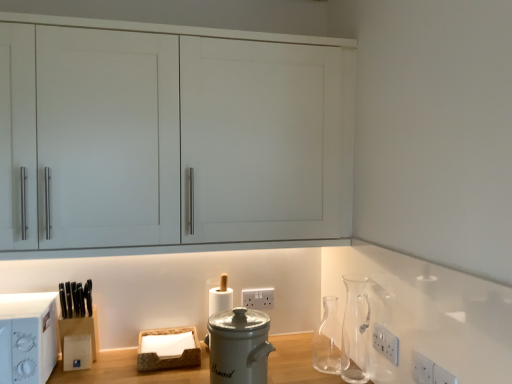
Question: From the image's perspective, is white plastic electric outlet at lower right, the 2th electric outlet from the right, located above or below white plastic electric outlet at lower center, the 1th electric outlet viewed from the left?

Choices:
 (A) above
 (B) below

Answer: (B)

Question: Considering the positions of white plastic electric outlet at lower right, the second electric outlet from the front, and white plastic electric outlet at lower center, acting as the fourth electric outlet starting from the right, in the image, is white plastic electric outlet at lower right, the second electric outlet from the front, bigger or smaller than white plastic electric outlet at lower center, acting as the fourth electric outlet starting from the right,?

Choices:
 (A) small
 (B) big

Answer: (A)

Question: Which is farther from the white plastic microwave at left?

Choices:
 (A) white plastic electric outlet at lower center, acting as the 1th electric outlet starting from the back
 (B) transparent glass carafe at center-right
 (C) transparent glass carafe at right
 (D) brown woven basket at lower center
 (E) white plastic electric outlet at lower right, the 3th electric outlet from the left

Answer: (E)

Question: Considering the real-world distances, which object is farthest from the white plastic electrical outlet at lower right, the 2th electric outlet viewed from the left?

Choices:
 (A) transparent glass carafe at center-right
 (B) white plastic microwave at left
 (C) brown woven basket at lower center
 (D) white ceramic bread bin at center
 (E) white plastic electric outlet at lower right, acting as the 1th electric outlet starting from the right

Answer: (B)